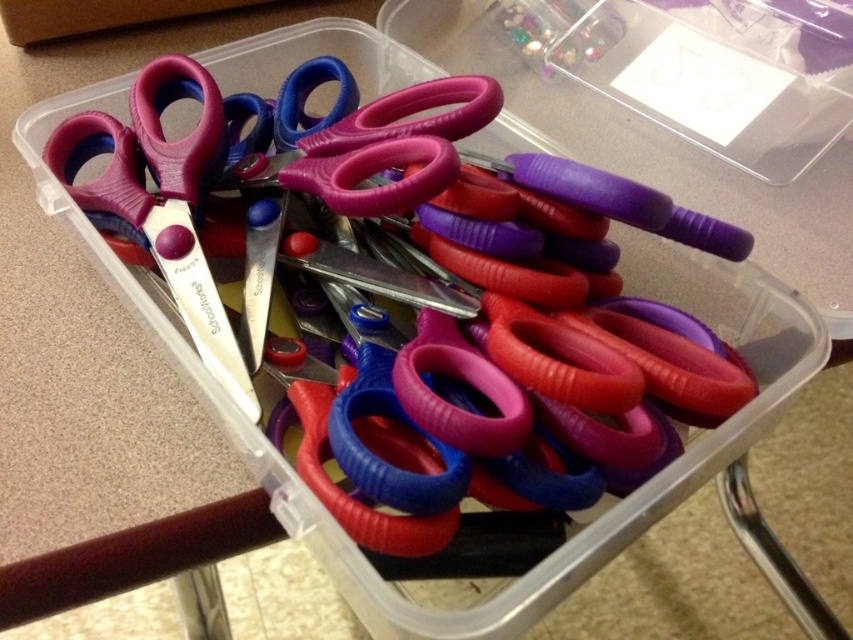
Question: Among these objects, which one is nearest to the camera?

Choices:
 (A) matte purple scissors at left
 (B) matte plastic scissors at center

Answer: (B)

Question: Among these objects, which one is nearest to the camera?

Choices:
 (A) matte plastic scissors at center
 (B) matte purple scissors at left

Answer: (A)

Question: Can you confirm if matte plastic scissors at center is positioned above matte purple scissors at left?

Choices:
 (A) no
 (B) yes

Answer: (A)

Question: Does matte plastic scissors at center have a smaller size compared to matte purple scissors at left?

Choices:
 (A) no
 (B) yes

Answer: (A)

Question: From the image, what is the correct spatial relationship of matte plastic scissors at center in relation to matte purple scissors at left?

Choices:
 (A) left
 (B) right

Answer: (B)